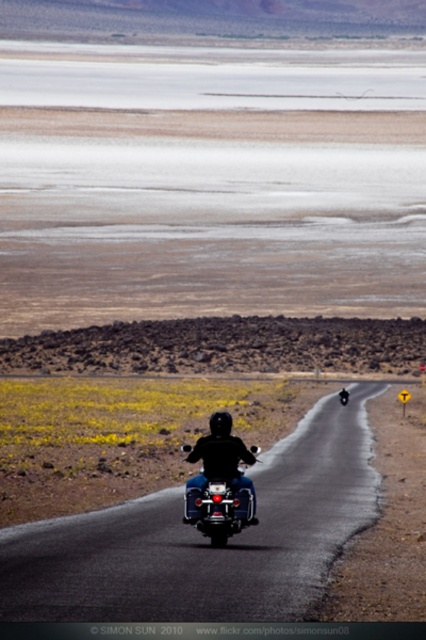
You are a photographer planning to take a picture of the black rubber motorcycle at center and the shiny chrome motorcycle at center. Since the road curves to the right, which motorcycle would be more likely to be hidden from view if you stand at the starting point of the road?

The black rubber motorcycle at center is positioned under the shiny chrome motorcycle at center, so it would be more likely to be hidden from view if you stand at the starting point of the road.